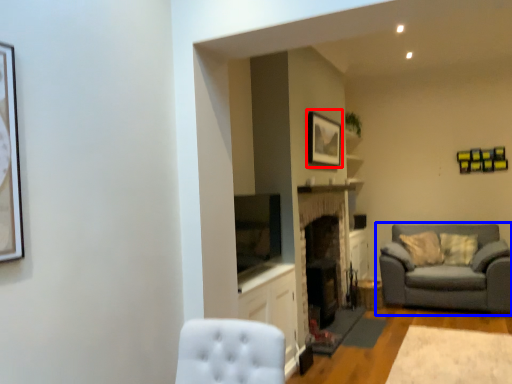
Question: Which of the following is the closest to the observer, picture frame (highlighted by a red box) or studio couch (highlighted by a blue box)?

Choices:
 (A) picture frame
 (B) studio couch

Answer: (A)